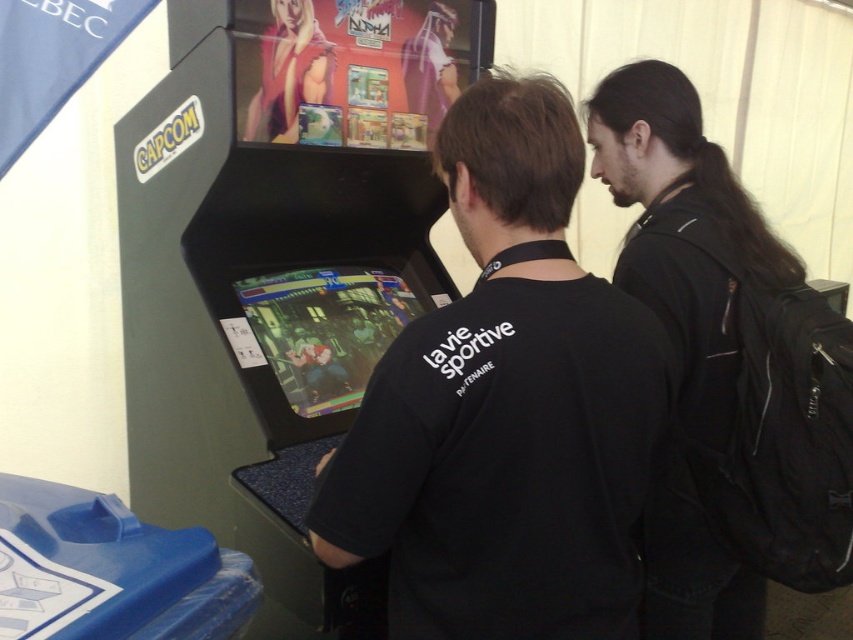
Question: Which object appears farthest from the camera in this image?

Choices:
 (A) black leather jacket at upper right
 (B) black matte shirt at center

Answer: (A)

Question: Observing the image, what is the correct spatial positioning of black matte shirt at center in reference to black leather jacket at upper right?

Choices:
 (A) above
 (B) below

Answer: (A)

Question: Where is black matte shirt at center located in relation to black leather jacket at upper right in the image?

Choices:
 (A) below
 (B) above

Answer: (B)

Question: Can you confirm if black matte shirt at center is bigger than black leather jacket at upper right?

Choices:
 (A) yes
 (B) no

Answer: (B)

Question: Which point is closer to the camera taking this photo?

Choices:
 (A) (509, 324)
 (B) (704, 262)

Answer: (A)